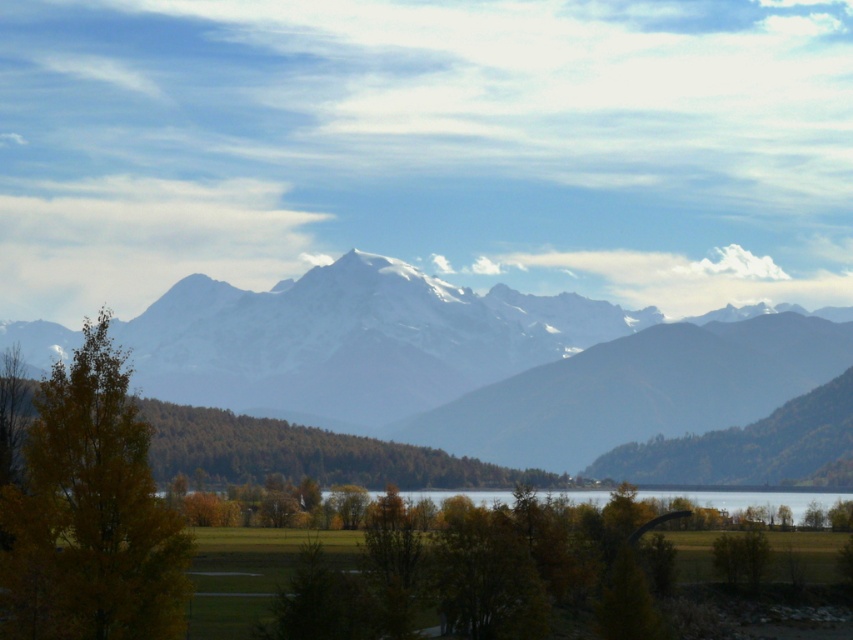
You are a hiker standing in the field looking towards the mountains. You see the brown matte tree at lower left and the transparent water at center. Which object is closer to you?

The brown matte tree at lower left is closer to you because it is in front of the transparent water at center.

You are standing at the point marked as point (x=305, y=452) in the image. What object is located at that point?

The point (x=305, y=452) corresponds to the brown matte tree at lower left.